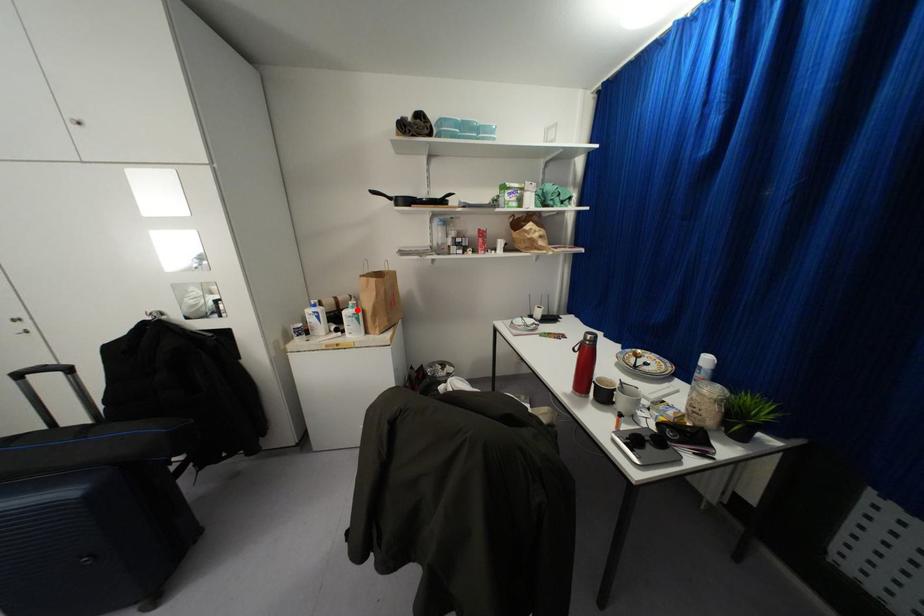
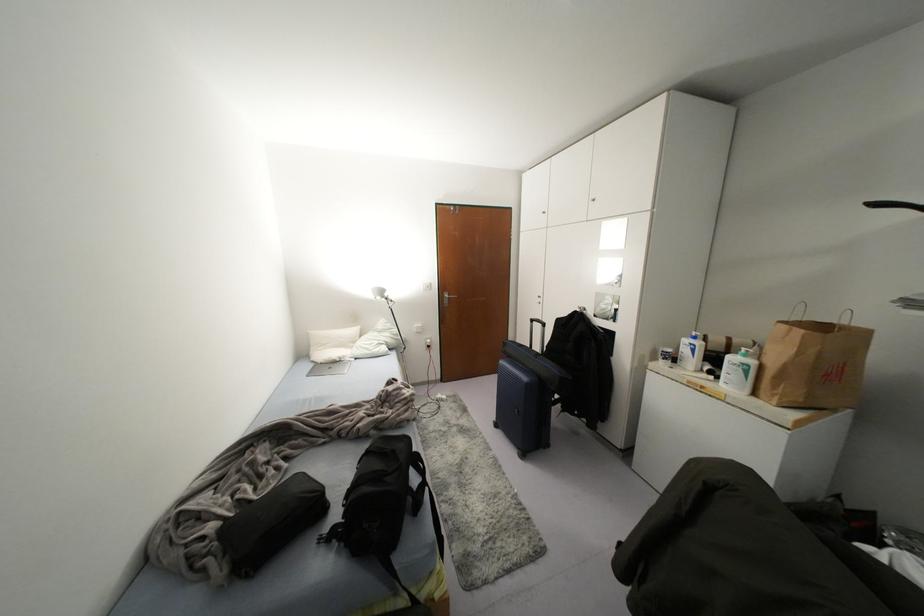
Locate, in the second image, the point that corresponds to the highlighted location in the first image.

(751, 362)